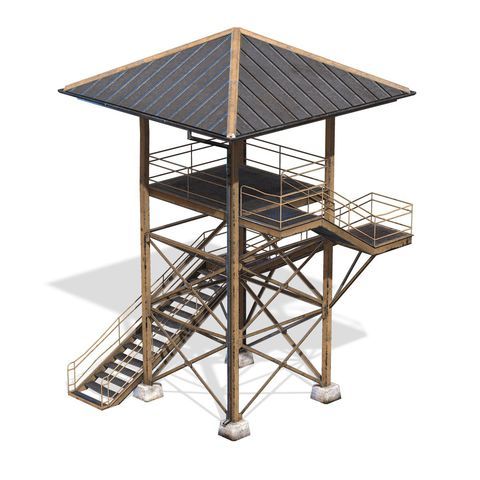
This screenshot has height=480, width=480. What are the coordinates of `support beams` in the screenshot? It's located at (238, 327), (144, 298), (240, 293), (325, 294).